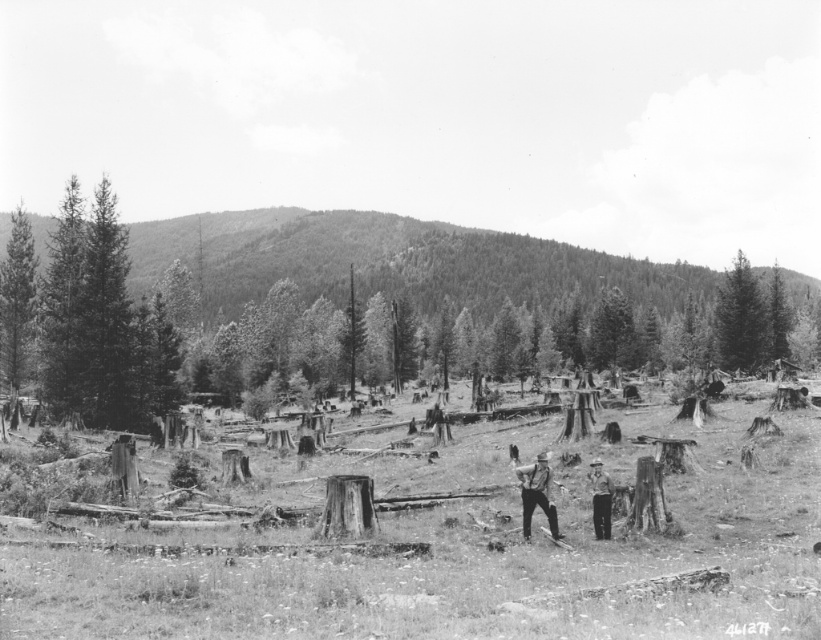
You are a photographer standing at the edge of the forest. You want to take a photo of the wooden stumps at center and the light brown wooden stick at center. Which object will appear closer to you in the photo?

The wooden stumps at center will appear closer to you in the photo because they are positioned in front of the light brown wooden stick at center.

Based on the scene described, if you were standing at the wooden stumps at center, which direction would you need to look to see the smooth green tree at upper right?

The wooden stumps at center are below the smooth green tree at upper right, so you would need to look upward and toward the right to see the smooth green tree at upper right.